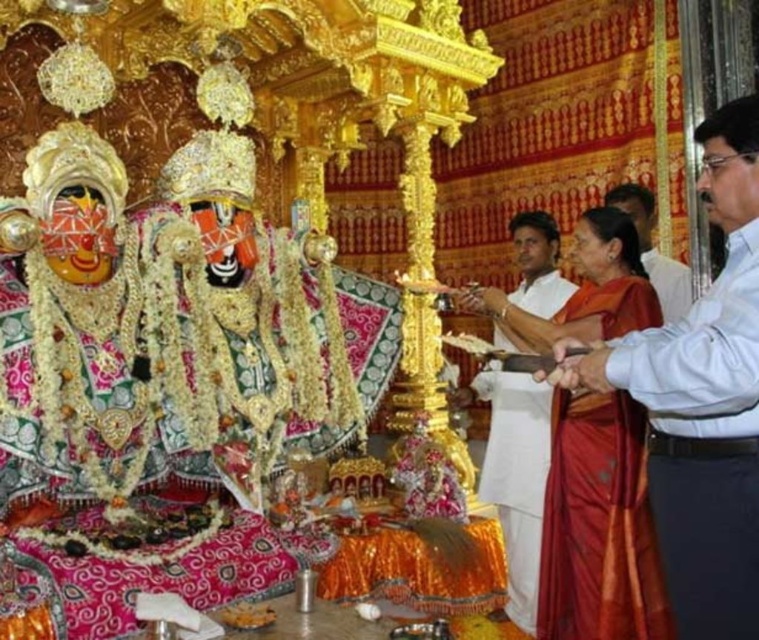
Who is higher up, maroon silk saree at right or white cotton shirt at right?

white cotton shirt at right is above.

Does point (742, 356) come farther from viewer compared to point (632, 220)?

No, it is not.

At what (x,y) coordinates should I click in order to perform the action: click on maroon silk saree at right. Please return your answer as a coordinate pair (x, y). Looking at the image, I should click on (704, 445).

Does maroon silk saree at right have a lesser width compared to silky red saree at right?

Indeed, maroon silk saree at right has a lesser width compared to silky red saree at right.

Does maroon silk saree at right appear over silky red saree at right?

Incorrect, maroon silk saree at right is not positioned above silky red saree at right.

Does point (717, 470) come in front of point (589, 400)?

Yes, point (717, 470) is in front of point (589, 400).

In order to click on maroon silk saree at right in this screenshot , I will do (704, 445).

Describe the element at coordinates (597, 525) in the screenshot. I see `silky red saree at right` at that location.

Which is above, silky red saree at right or silky orange sari at center?

Positioned higher is silky orange sari at center.

Is point (609, 637) positioned before point (521, 429)?

That is True.

Locate an element on the screen. silky red saree at right is located at coordinates (597, 525).